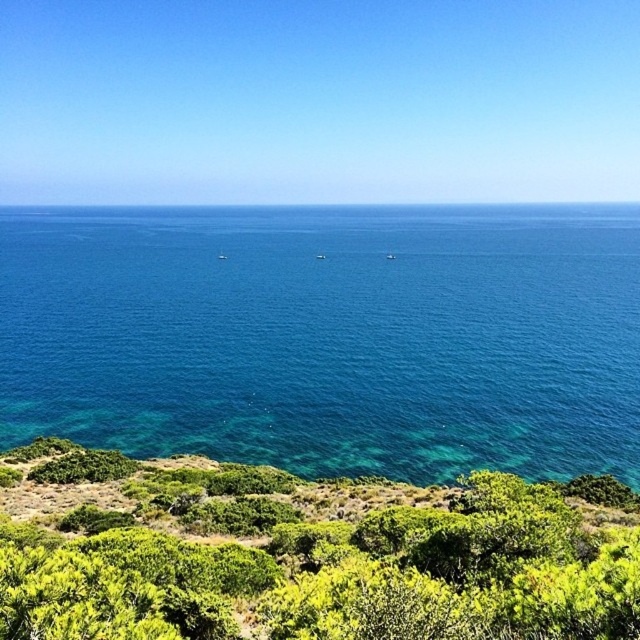
Question: Is clear blue water at center positioned behind green leafy shrubs at lower center?

Choices:
 (A) yes
 (B) no

Answer: (A)

Question: Which of the following is the closest to the observer?

Choices:
 (A) clear blue water at center
 (B) green leafy shrubs at lower center

Answer: (B)

Question: Among these points, which one is nearest to the camera?

Choices:
 (A) (436, 214)
 (B) (328, 616)

Answer: (B)

Question: Which point is farther from the camera taking this photo?

Choices:
 (A) (464, 225)
 (B) (33, 564)

Answer: (A)

Question: Does clear blue water at center have a lesser width compared to green leafy shrubs at lower center?

Choices:
 (A) no
 (B) yes

Answer: (A)

Question: Can you confirm if clear blue water at center is positioned above green leafy shrubs at lower center?

Choices:
 (A) yes
 (B) no

Answer: (A)